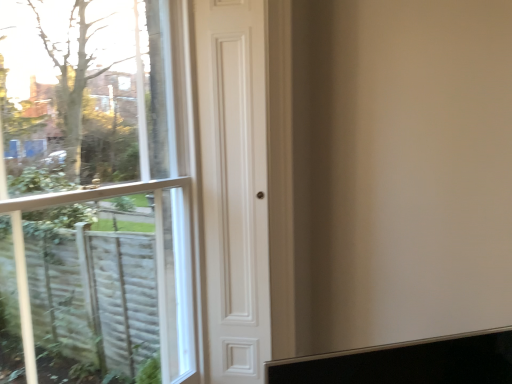
This screenshot has width=512, height=384. What do you see at coordinates (102, 188) in the screenshot?
I see `clear glass window at left` at bounding box center [102, 188].

Measure the distance between point [152,167] and camera.

Point [152,167] and camera are 6.71 feet apart.

Identify the location of clear glass window at left. The width and height of the screenshot is (512, 384). (102, 188).

Locate an element on the screen. This screenshot has width=512, height=384. clear glass window at left is located at coordinates (102, 188).